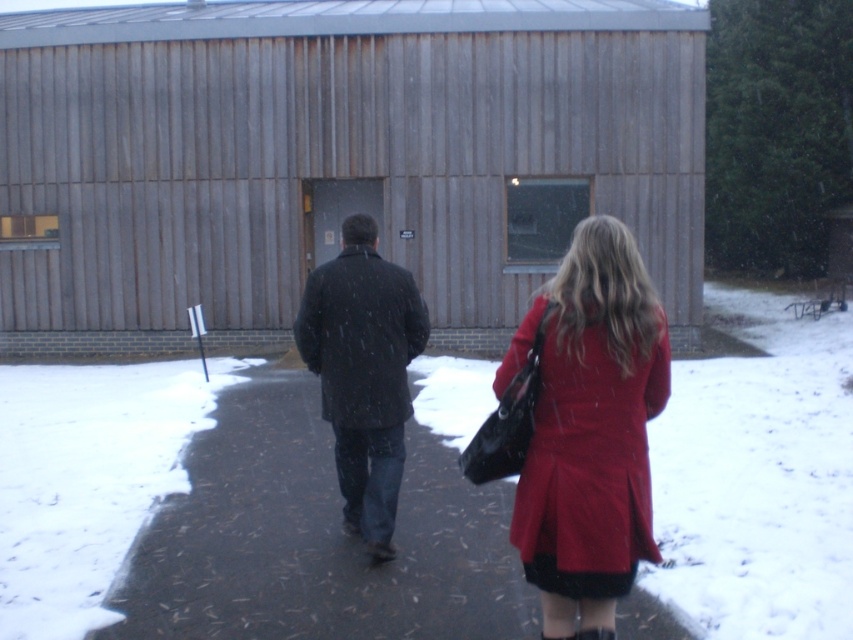
Between point (642, 284) and point (641, 412), which one is positioned behind?

The point (641, 412) is more distant.

At what (x,y) coordinates should I click in order to perform the action: click on matte black coat at center. Please return your answer as a coordinate pair (x, y). The image size is (853, 640). Looking at the image, I should click on (589, 429).

Locate an element on the screen. The height and width of the screenshot is (640, 853). matte black coat at center is located at coordinates [x=589, y=429].

Does point (578, 404) come closer to viewer compared to point (387, 468)?

Yes, point (578, 404) is in front of point (387, 468).

Is matte black coat at center taller than dark matte coat at center?

No, matte black coat at center is not taller than dark matte coat at center.

Identify the location of matte black coat at center. (589, 429).

Between point (82, 60) and point (518, 483), which one is positioned behind?

Point (82, 60)

Is wooden barn at center above matte black coat at center?

Yes, wooden barn at center is above matte black coat at center.

Does point (51, 310) lie behind point (608, 284)?

Yes, it is behind point (608, 284).

This screenshot has width=853, height=640. Identify the location of wooden barn at center. (335, 161).